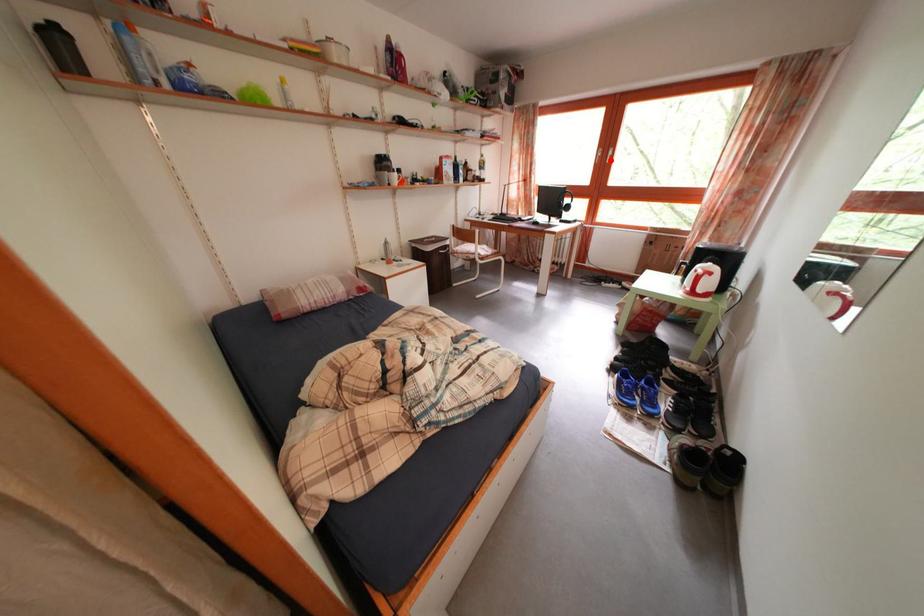
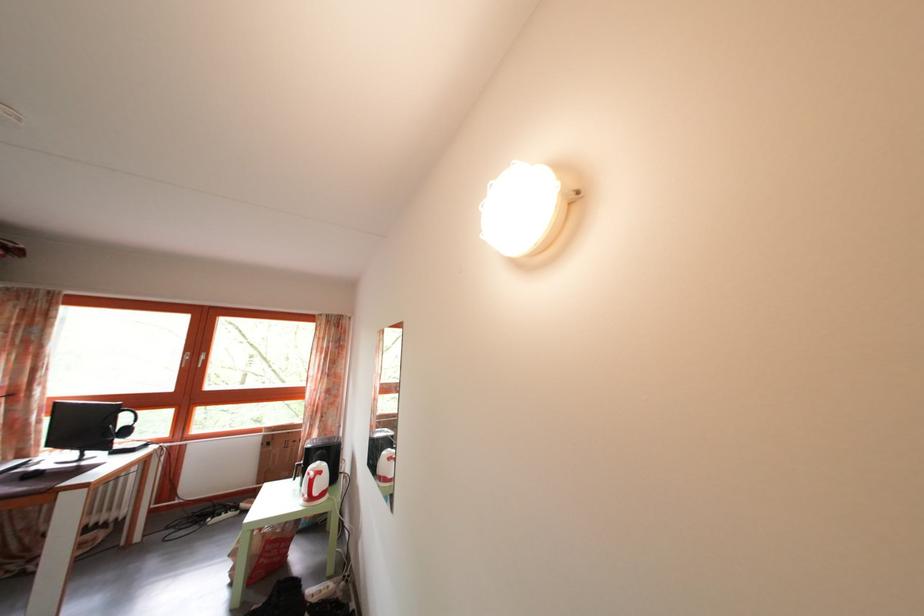
Question: I am providing you with two images of the same scene from different viewpoints. In image1, a red point is highlighted. Considering the same 3D point in image2, which of the following is correct?

Choices:
 (A) It is closer
 (B) It is farther

Answer: (B)